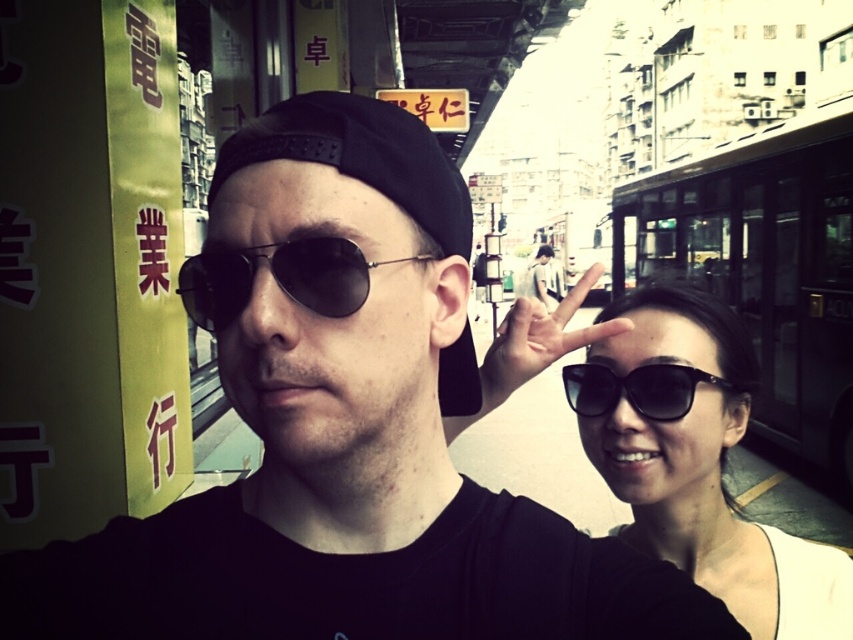
You are a photographer trying to capture a photo of both the person taking a selfie and the one making a peace sign. You notice two points in the image labeled as point 1 at coordinates [788,586] and point 2 at coordinates [579,289]. Based on their positions, which point is closer to the photographer?

Point 1 at coordinates [788,586] is closer to the photographer because it is in front of point 2 at coordinates [579,289].

You are a photographer trying to capture the scene where the black matte hand at center and the black matte sunglasses at right are both visible. Which object should you focus on first to ensure both are in sharp focus?

You should focus on the black matte hand at center first because it is closer to the viewer than the black matte sunglasses at right, ensuring both are in focus when using depth of field appropriately.

You are a photographer trying to capture a photo of the black matte sunglasses at upper right in the scene. However, there is a point at coordinates point (697, 460) that might be obstructing your view. Is this point located on the black matte sunglasses at upper right?

Yes, the point (697, 460) is located on the black matte sunglasses at upper right, so it may obstruct your view.